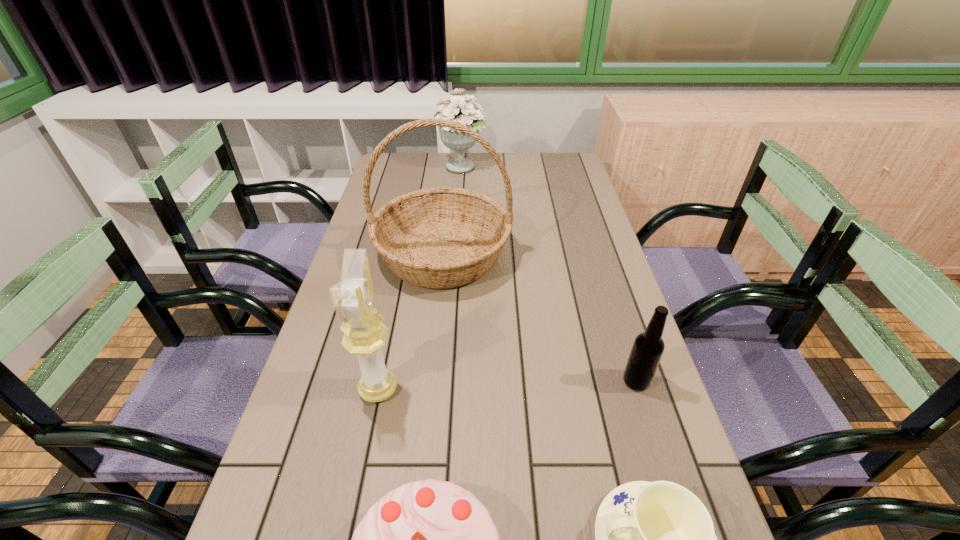
Locate which object ranks third in proximity to the chinaware. Please provide its 2D coordinates. Your answer should be formatted as a tuple, i.e. [(x, y)], where the tuple contains the x and y coordinates of a point satisfying the conditions above.

[(353, 297)]

Locate which object is the third closest to the fifth tallest object. Please provide its 2D coordinates. Your answer should be formatted as a tuple, i.e. [(x, y)], where the tuple contains the x and y coordinates of a point satisfying the conditions above.

[(647, 350)]

Locate an element on the screen. free space that satisfies the following two spatial constraints: 1. on the front side of the bouquet; 2. on the front-facing side of the award is located at coordinates (448, 389).